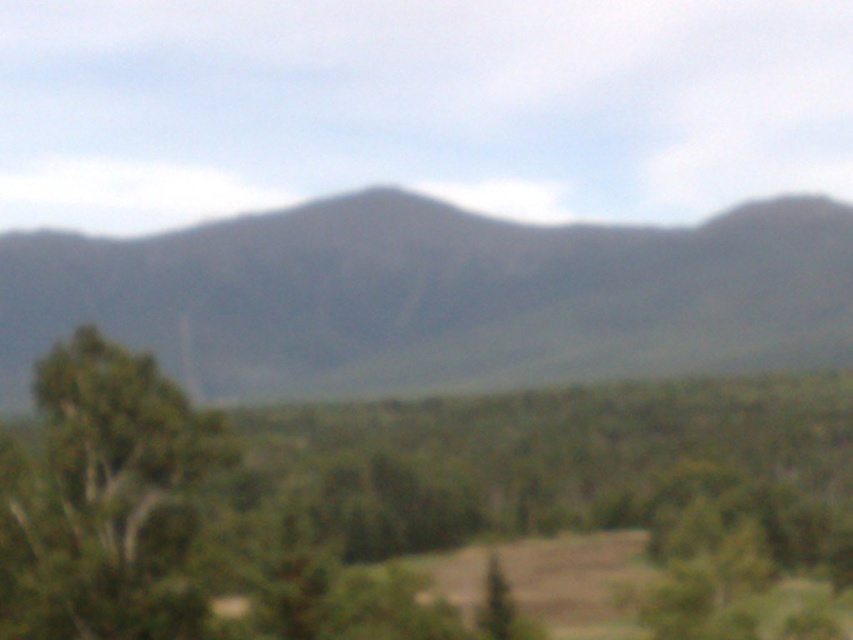
Who is lower down, green leafy tree at center or green leafy tree at left?

green leafy tree at left is lower down.

At what (x,y) coordinates should I click in order to perform the action: click on green leafy tree at center. Please return your answer as a coordinate pair (x, y). This screenshot has height=640, width=853. Looking at the image, I should click on (410, 506).

Who is taller, gray matte mountain at center or green leafy tree at left?

Standing taller between the two is gray matte mountain at center.

Is gray matte mountain at center shorter than green leafy tree at left?

In fact, gray matte mountain at center may be taller than green leafy tree at left.

Where is `gray matte mountain at center`? gray matte mountain at center is located at coordinates (434, 296).

Is green leafy tree at center above gray matte mountain at center?

Incorrect, green leafy tree at center is not positioned above gray matte mountain at center.

Between point (108, 490) and point (6, 253), which one is positioned behind?

The point (6, 253) is more distant.

This screenshot has width=853, height=640. What are the coordinates of `green leafy tree at center` in the screenshot? It's located at (410, 506).